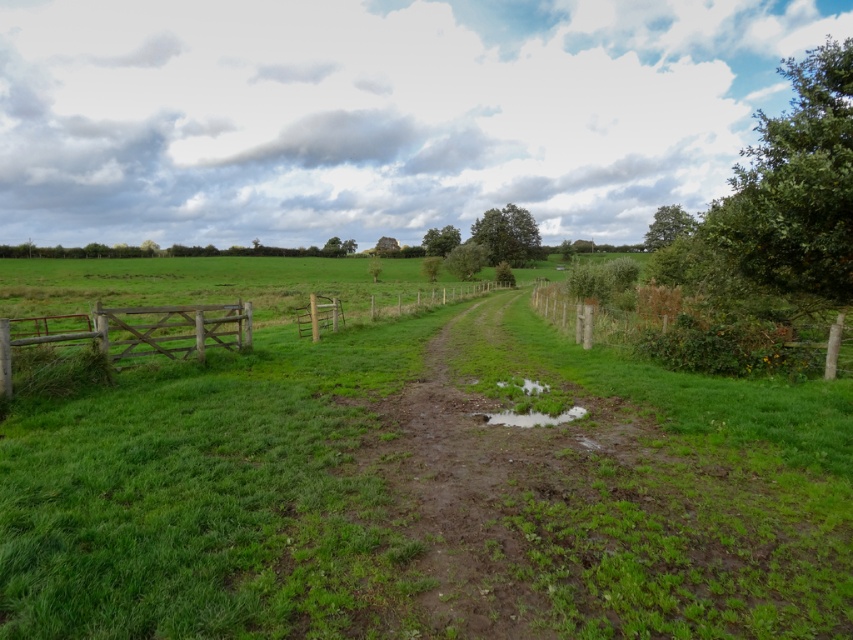
Question: Is green grassy at center wider than transparent water at center?

Choices:
 (A) yes
 (B) no

Answer: (A)

Question: Can you confirm if wooden gate at center is positioned to the right of transparent water at center?

Choices:
 (A) yes
 (B) no

Answer: (B)

Question: Which point is closer to the camera?

Choices:
 (A) wooden gate at center
 (B) green grassy at center
 (C) transparent water at center
 (D) wooden fence at right

Answer: (B)

Question: Which object is the farthest from the green grassy at center?

Choices:
 (A) wooden fence at right
 (B) wooden gate at center

Answer: (B)

Question: Among these objects, which one is nearest to the camera?

Choices:
 (A) green grassy at center
 (B) wooden gate at left

Answer: (A)

Question: Can you confirm if wooden fence at right is thinner than transparent water at center?

Choices:
 (A) no
 (B) yes

Answer: (A)